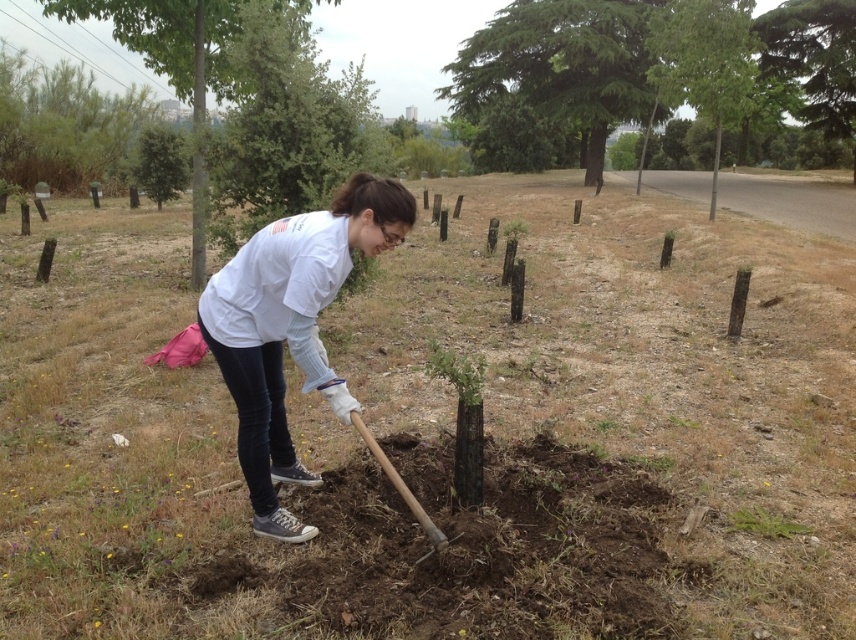
Is point (86, 140) closer to camera compared to point (384, 465)?

No, (86, 140) is behind (384, 465).

Does green leafy tree at upper left appear under wooden shovel at center?

No.

Identify the location of green leafy tree at upper left. The image size is (856, 640). (64, 125).

Does white cotton shirt at center come in front of green matte tree at center?

Yes, it is.

Who is lower down, white cotton shirt at center or green matte tree at center?

white cotton shirt at center is lower down.

Is point (318, 234) positioned before point (199, 284)?

Yes, point (318, 234) is closer to viewer.

This screenshot has height=640, width=856. Find the location of `white cotton shirt at center`. white cotton shirt at center is located at coordinates (290, 326).

Does green textured tree at upper right have a larger size compared to wooden shovel at center?

Incorrect, green textured tree at upper right is not larger than wooden shovel at center.

At what (x,y) coordinates should I click in order to perform the action: click on green textured tree at upper right. Please return your answer as a coordinate pair (x, y). The image size is (856, 640). Looking at the image, I should click on (813, 58).